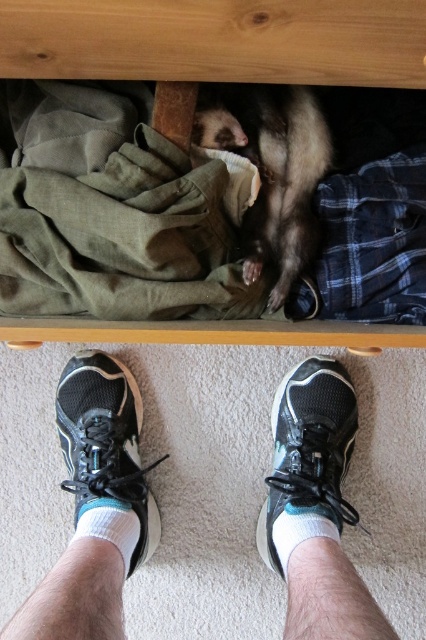
Question: Considering the relative positions of black mesh sneakers at center and black mesh shoe at center in the image provided, where is black mesh sneakers at center located with respect to black mesh shoe at center?

Choices:
 (A) above
 (B) below

Answer: (B)

Question: Which point is farther from the camera taking this photo?

Choices:
 (A) (132, 468)
 (B) (244, 124)
 (C) (279, 385)
 (D) (60, 577)

Answer: (C)

Question: Is fuzzy brown ferret at center wider than black mesh shoe at center?

Choices:
 (A) no
 (B) yes

Answer: (A)

Question: Does fuzzy brown ferret at center appear over black mesh shoe at lower center?

Choices:
 (A) yes
 (B) no

Answer: (A)

Question: Which of the following is the farthest from the observer?

Choices:
 (A) (126, 506)
 (B) (89, 506)
 (C) (294, 472)

Answer: (C)

Question: Based on their relative distances, which object is nearer to the black mesh sneakers at center?

Choices:
 (A) black mesh shoe at center
 (B) black mesh shoe at lower center
 (C) fuzzy brown ferret at center

Answer: (A)